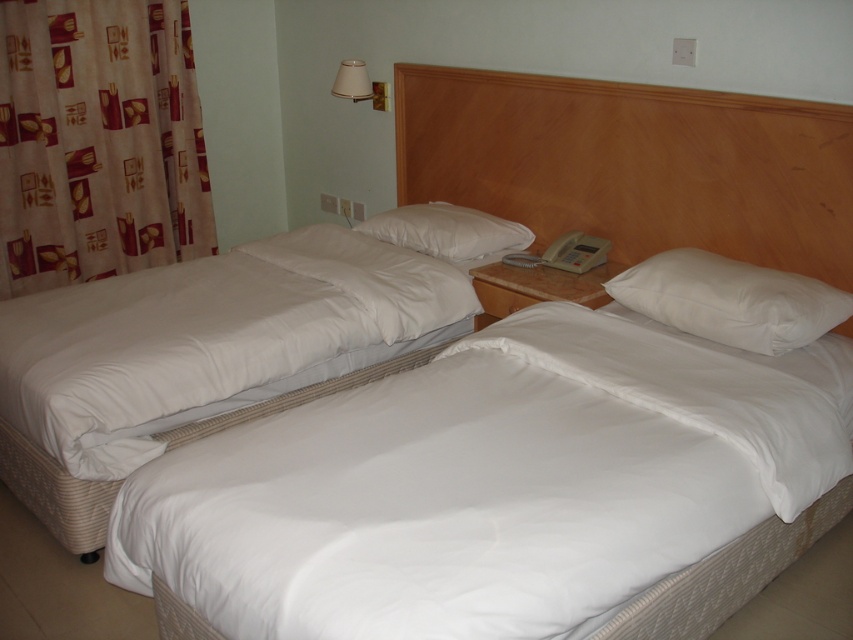
You are standing in the hotel room and want to place a small vase on the closest bed to you. Which bed should you choose between the white fabric bed at lower left and the white soft pillow at center?

The white fabric bed at lower left is closer to the viewer than the white soft pillow at center, so you should place the vase on the white fabric bed at lower left.